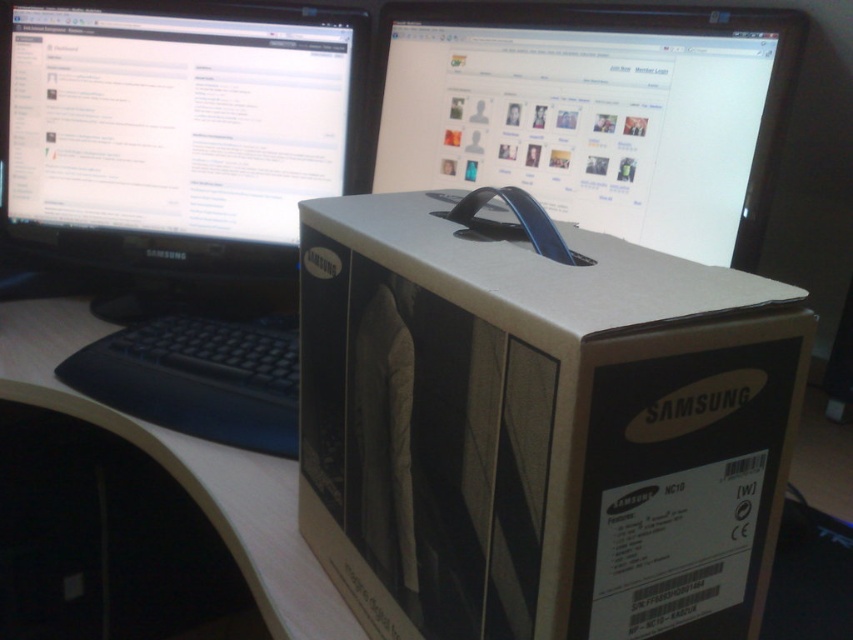
You are organizing your desk and need to place a new 16.5 inch wide laptop between the white cardboard box at center and the matte black monitor at center. Can the laptop fit in the space between them?

The space between the white cardboard box at center and the matte black monitor at center is 18.15 inches. Since the laptop is 16.5 inches wide, it can fit in the available space.

You are organizing your desk and want to place the black plastic keyboard at lower left closer to the matte black monitor at center. How much distance do you need to move the keyboard to align it with the monitor?

The matte black monitor at center and black plastic keyboard at lower left are 43.28 centimeters apart. To align the keyboard with the monitor, you need to move it 43.28 centimeters closer.

You are standing at the position of the camera, looking at the workspace. There is a point marked at coordinates (302, 490) on the desk. If you want to place a 12 inch ruler from the camera to this point, will it reach exactly to the point without extending beyond it?

The distance between the camera and the point is 29.03 inches. Since the ruler is only 12 inches long, it will not reach the point and will fall short by 17.03 inches.